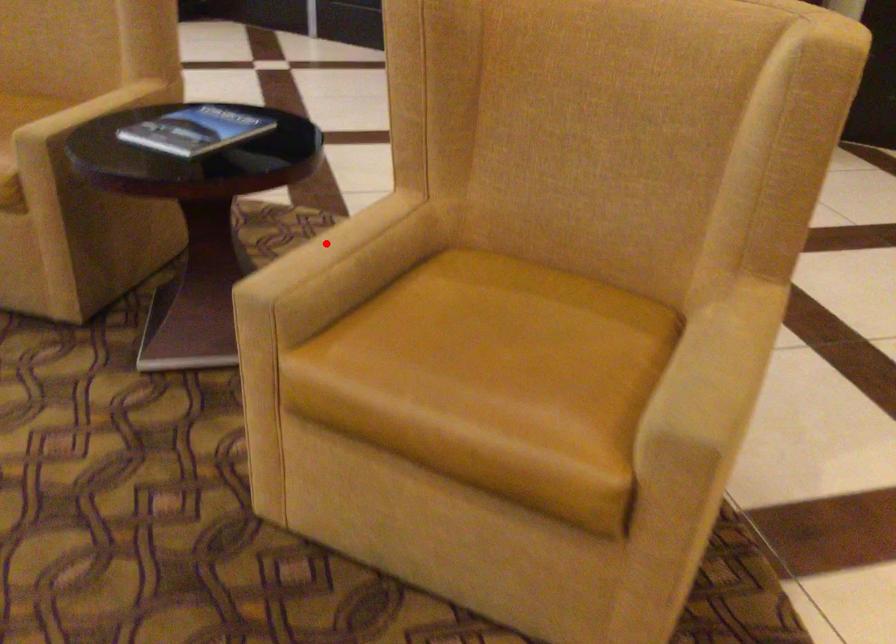
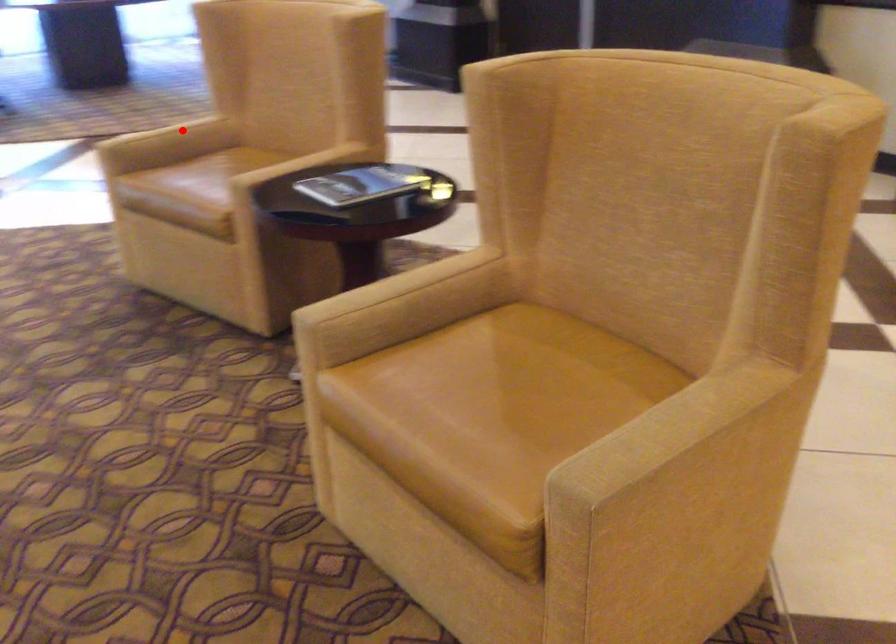
I am providing you with two images of the same scene from different viewpoints. A red point is marked on the first image and another point is marked on the second image. Is the marked point in image1 the same physical position as the marked point in image2?

No